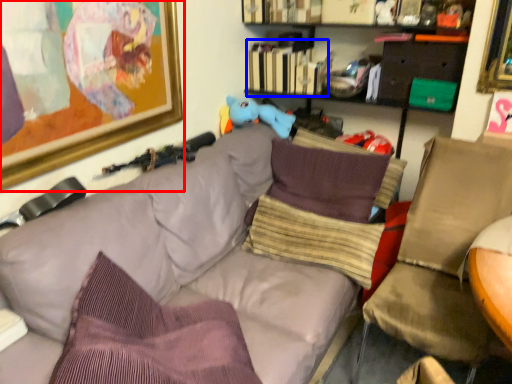
Question: Which object appears closest to the camera in this image, picture frame (highlighted by a red box) or book (highlighted by a blue box)?

Choices:
 (A) picture frame
 (B) book

Answer: (A)